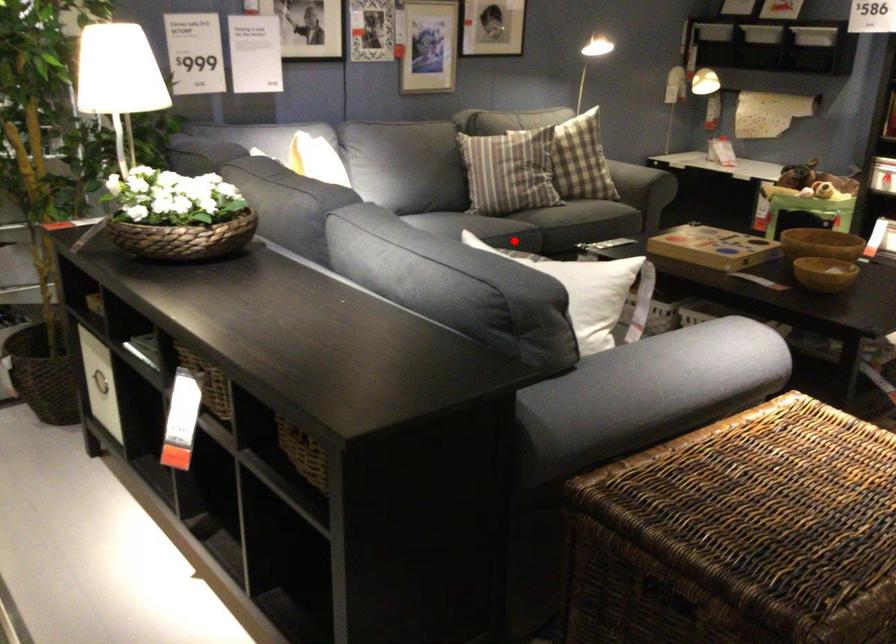
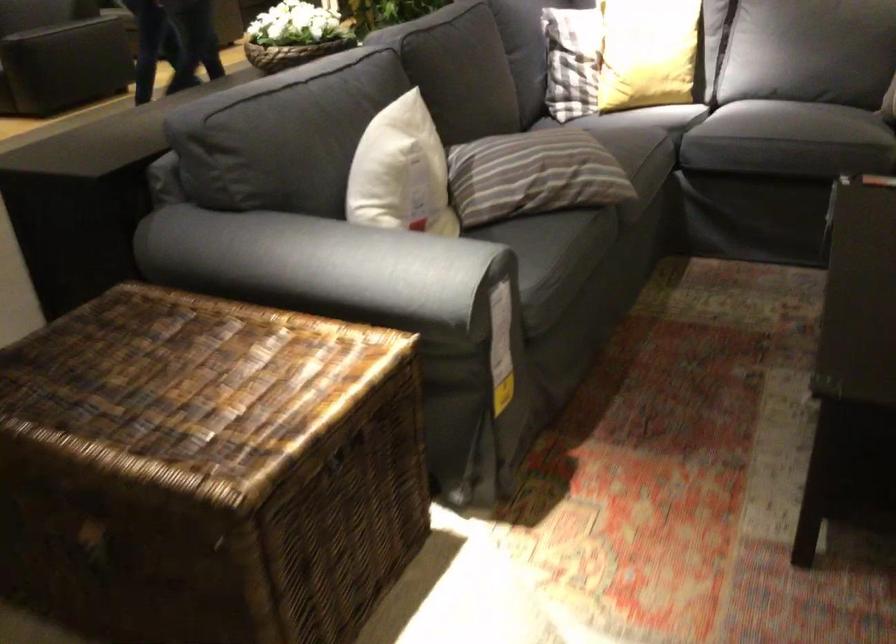
Question: I am providing you with two images of the same scene from different viewpoints. A red point is shown in image1. For the corresponding object point in image2, is it positioned nearer or farther from the camera?

Choices:
 (A) Nearer
 (B) Farther

Answer: (A)